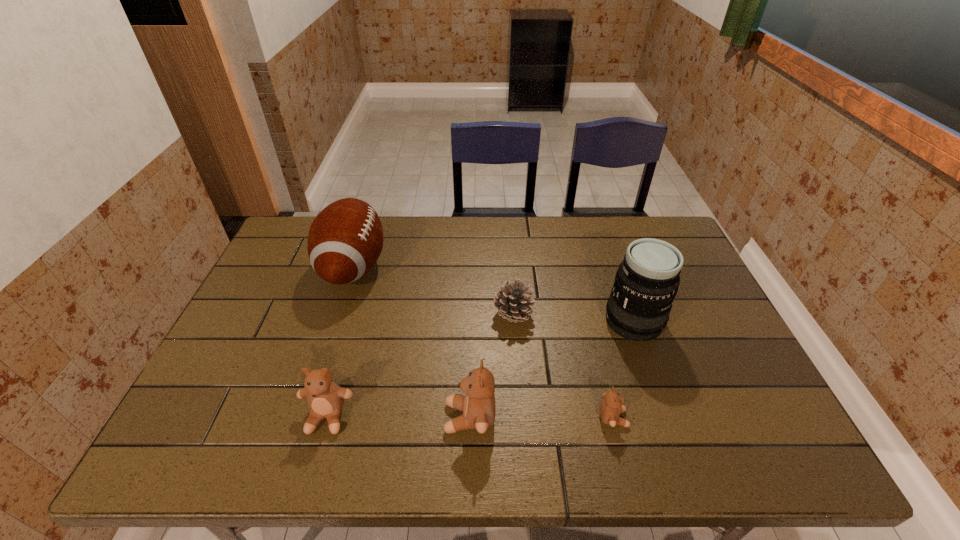
This screenshot has height=540, width=960. Identify the location of the fourth tallest object. (325, 398).

Where is `the second tallest teddy bear`? The image size is (960, 540). the second tallest teddy bear is located at coordinates (325, 398).

Locate an element on the screen. This screenshot has height=540, width=960. the second teddy bear from left to right is located at coordinates (478, 406).

At what (x,y) coordinates should I click in order to perform the action: click on the shortest teddy bear. Please return your answer as a coordinate pair (x, y). The image size is (960, 540). Looking at the image, I should click on (611, 406).

You are a GUI agent. You are given a task and a screenshot of the screen. Output one action in this format:
    pyautogui.click(x=<x>, y=<y>)
    Task: Click on the shortest object
    The height and width of the screenshot is (540, 960).
    Given the screenshot: What is the action you would take?
    pyautogui.click(x=611, y=406)

At what (x,y) coordinates should I click in order to perform the action: click on football. Please return your answer as a coordinate pair (x, y). Image resolution: width=960 pixels, height=540 pixels. Looking at the image, I should click on (345, 240).

Image resolution: width=960 pixels, height=540 pixels. Identify the location of the rightmost object. (647, 280).

In order to click on the fifth tallest object in this screenshot , I will do `click(513, 301)`.

Where is `pinecone`? pinecone is located at coordinates (513, 301).

Find the location of `vacant space located on the front-facing side of the third object from left to right`. vacant space located on the front-facing side of the third object from left to right is located at coordinates 274,417.